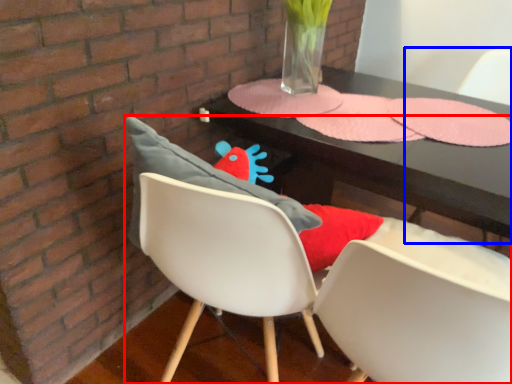
Question: Which point is further to the camera, chair (highlighted by a red box) or armchair (highlighted by a blue box)?

Choices:
 (A) chair
 (B) armchair

Answer: (B)